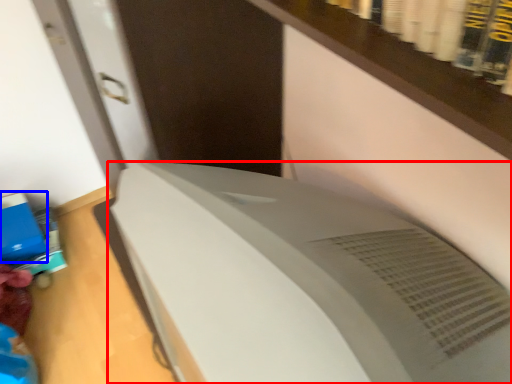
Question: Which point is closer to the camera, home appliance (highlighted by a red box) or paperback book (highlighted by a blue box)?

Choices:
 (A) home appliance
 (B) paperback book

Answer: (A)